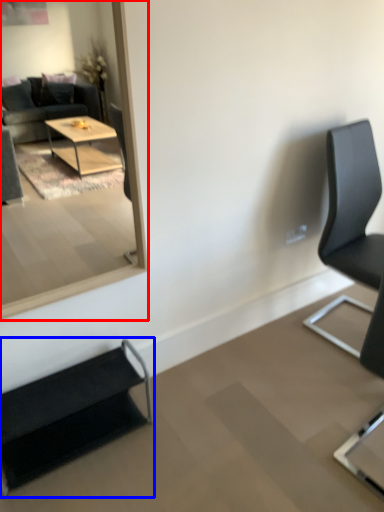
Question: Which of the following is the farthest to the observer, mirror (highlighted by a red box) or chair (highlighted by a blue box)?

Choices:
 (A) mirror
 (B) chair

Answer: (B)